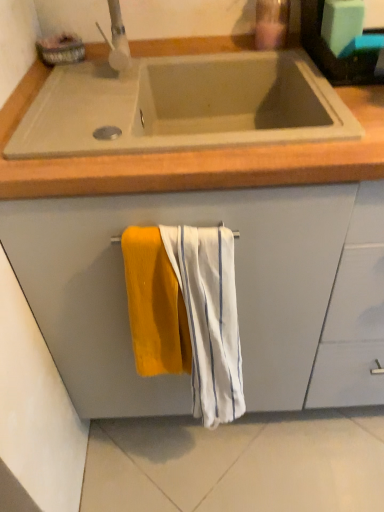
Question: Would you consider beige concrete sink at upper center to be distant from white textured towel at center, the 1th beach towel in the right-to-left sequence?

Choices:
 (A) yes
 (B) no

Answer: (B)

Question: Can you confirm if beige concrete sink at upper center is bigger than white textured towel at center, the second beach towel when ordered from left to right?

Choices:
 (A) no
 (B) yes

Answer: (B)

Question: Considering the relative sizes of beige concrete sink at upper center and white textured towel at center, the 1th beach towel in the right-to-left sequence, in the image provided, is beige concrete sink at upper center smaller than white textured towel at center, the 1th beach towel in the right-to-left sequence,?

Choices:
 (A) yes
 (B) no

Answer: (B)

Question: Can you see beige concrete sink at upper center touching white textured towel at center, the 1th beach towel in the right-to-left sequence?

Choices:
 (A) no
 (B) yes

Answer: (A)

Question: Can you confirm if beige concrete sink at upper center is positioned to the left of white textured towel at center, the 1th beach towel in the right-to-left sequence?

Choices:
 (A) yes
 (B) no

Answer: (A)

Question: Is beige concrete sink at upper center looking in the opposite direction of white textured towel at center, the 1th beach towel in the right-to-left sequence?

Choices:
 (A) no
 (B) yes

Answer: (A)

Question: Is translucent plastic soap dispenser at upper center smaller than soft yellow towel at center, positioned as the 1th beach towel in left-to-right order?

Choices:
 (A) yes
 (B) no

Answer: (A)

Question: Does translucent plastic soap dispenser at upper center have a greater width compared to soft yellow towel at center, which is the second beach towel in right-to-left order?

Choices:
 (A) no
 (B) yes

Answer: (B)

Question: Is the position of translucent plastic soap dispenser at upper center less distant than that of soft yellow towel at center, positioned as the 1th beach towel in left-to-right order?

Choices:
 (A) yes
 (B) no

Answer: (B)

Question: From a real-world perspective, is translucent plastic soap dispenser at upper center on soft yellow towel at center, positioned as the 1th beach towel in left-to-right order?

Choices:
 (A) yes
 (B) no

Answer: (A)

Question: Does translucent plastic soap dispenser at upper center turn towards soft yellow towel at center, positioned as the 1th beach towel in left-to-right order?

Choices:
 (A) yes
 (B) no

Answer: (B)

Question: Can we say translucent plastic soap dispenser at upper center lies outside soft yellow towel at center, which is the second beach towel in right-to-left order?

Choices:
 (A) no
 (B) yes

Answer: (B)

Question: Can you confirm if matte gray cabinet at center is shorter than beige concrete sink at upper center?

Choices:
 (A) yes
 (B) no

Answer: (B)